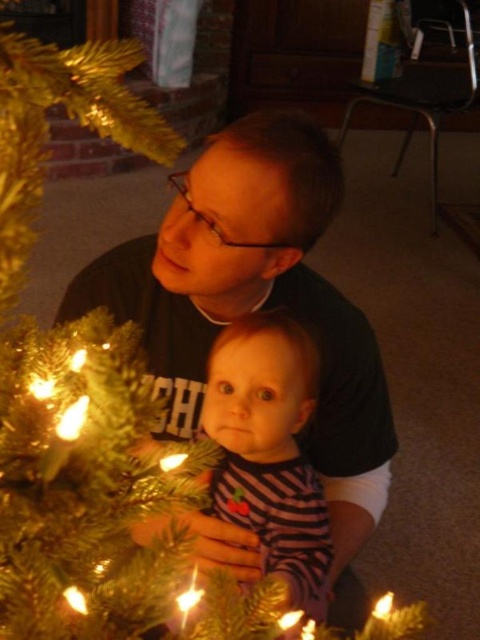
Question: Is striped fabric baby at center thinner than translucent glass candle at lower center?

Choices:
 (A) yes
 (B) no

Answer: (B)

Question: Which point is closer to the camera?

Choices:
 (A) matte black shirt at center
 (B) translucent amber candle at lower right
 (C) shiny gold candle at lower center

Answer: (C)

Question: Does matte black shirt at center have a smaller size compared to shiny gold candle at lower center?

Choices:
 (A) no
 (B) yes

Answer: (A)

Question: Does striped fabric baby at center have a larger size compared to shiny gold candle at lower center?

Choices:
 (A) no
 (B) yes

Answer: (B)

Question: Which point is closer to the camera taking this photo?

Choices:
 (A) (186, 595)
 (B) (314, 620)

Answer: (A)

Question: Which point appears farthest from the camera in this image?

Choices:
 (A) (375, 616)
 (B) (315, 221)
 (C) (217, 349)

Answer: (C)